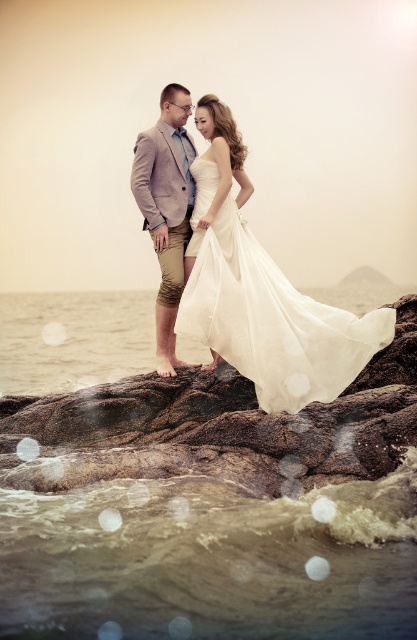
You are a photographer planning to take a photo of the couple. The white sheer dress at center and the satin white dress at center are part of the scene. Given that the minimum focus distance for your camera is 4 feet, will both dresses be in focus if you focus on one of them?

The distance between the white sheer dress at center and the satin white dress at center is 4.57 feet. Since the minimum focus distance is 4 feet, focusing on one dress will keep both in focus as the separation is within the camera focus range.

You are a photographer planning to capture the couple in the scene. The white sheer dress at center and the satin white dress at center are both present. Since you want to ensure the dress with the wider silhouette is visible, which dress should you focus on?

The white sheer dress at center has a greater width than the satin white dress at center, so focusing on the white sheer dress at center will highlight its wider silhouette.